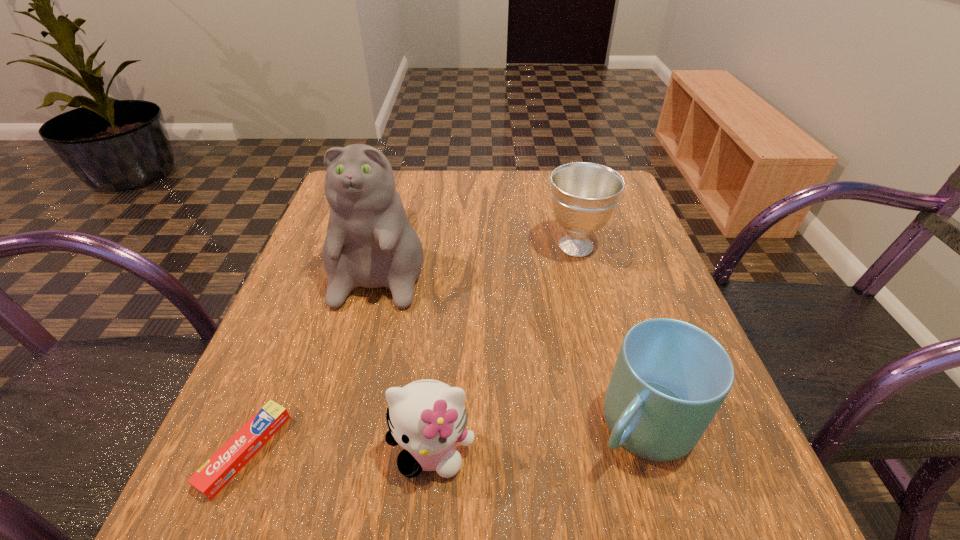
The image size is (960, 540). Find the location of `free space between the toothpaste and the tallest object`. free space between the toothpaste and the tallest object is located at coordinates 315,353.

Locate an element on the screen. This screenshot has width=960, height=540. vacant point located between the kitten and the mug is located at coordinates (537, 438).

Where is `empty space between the cat and the shortest object`? The height and width of the screenshot is (540, 960). empty space between the cat and the shortest object is located at coordinates (x=315, y=353).

What are the coordinates of `vacant space that is in between the kitten and the tallest object` in the screenshot? It's located at (407, 353).

Where is `unoccupied area between the shortest object and the kitten`? The image size is (960, 540). unoccupied area between the shortest object and the kitten is located at coordinates (339, 451).

Where is `blank region between the tallest object and the mug`? The image size is (960, 540). blank region between the tallest object and the mug is located at coordinates (513, 339).

I want to click on the fourth closest object relative to the chalice, so click(213, 476).

Find the location of a particular element. object that is the second closest to the kitten is located at coordinates (670, 378).